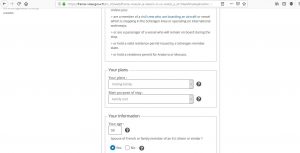
The image size is (300, 153). What are the coordinates of `drop down bar` in the screenshot? It's located at pos(112,84).